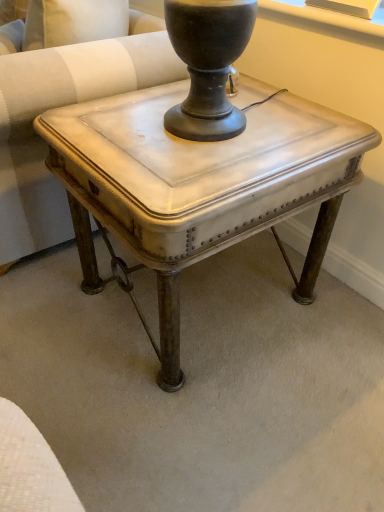
You are a GUI agent. You are given a task and a screenshot of the screen. Output one action in this format:
    pyautogui.click(x=<x>, y=<y>)
    Task: Click on the empty space that is ontop of white painted wood table at center (from a real-world perspective)
    
    Given the screenshot: What is the action you would take?
    pyautogui.click(x=206, y=141)